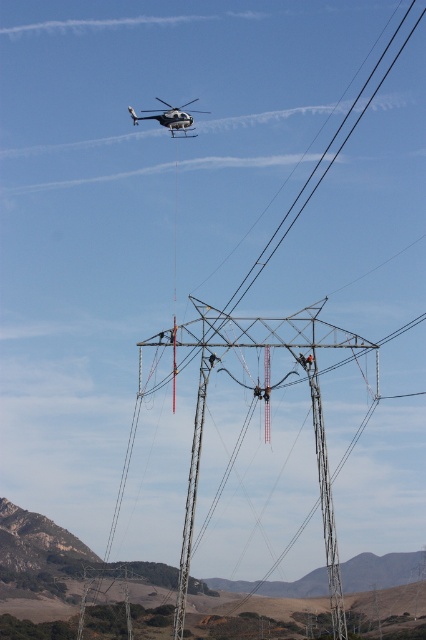
Does metallic silver tower at center have a lesser width compared to white glossy helicopter at upper center?

In fact, metallic silver tower at center might be wider than white glossy helicopter at upper center.

Which is above, metallic silver tower at center or white glossy helicopter at upper center?

Positioned higher is white glossy helicopter at upper center.

Find the location of `metallic silver tower at center`. metallic silver tower at center is located at coordinates (311, 412).